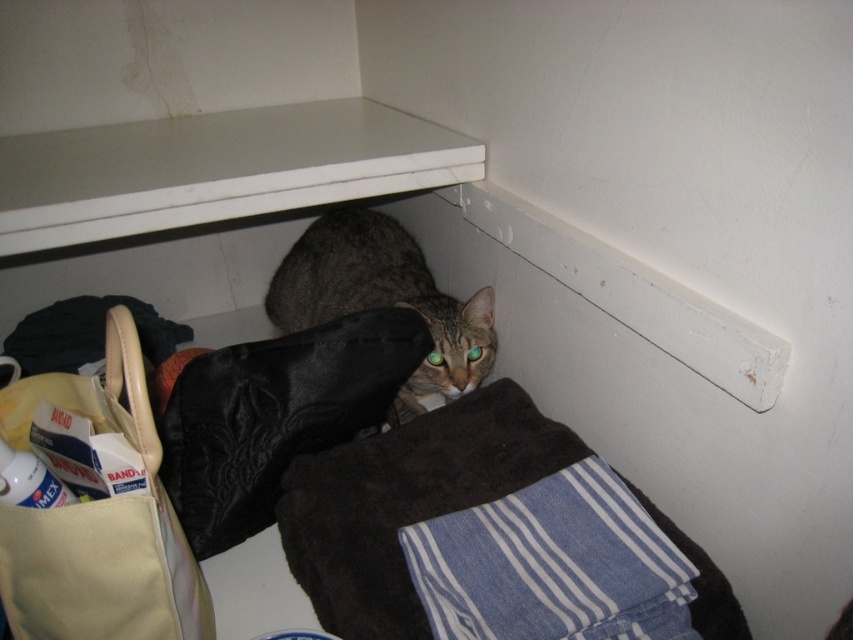
From the picture: You are organizing items in a storage area and need to place a new box on the white matte shelf at upper center. According to the scene description, where exactly is the white matte shelf located?

The white matte shelf at upper center is located at point (x=216, y=170), so you can place the box there.

You are standing in the storage area and see two points marked in the image. Which point is closer to you, point (502, 566) or point (166, 579)?

Point (502, 566) is further to the viewer than point (166, 579), so point (502, 566) is closer to you.

You are organizing the storage area and need to place both the blue striped fabric at lower right and the yellow fabric bag at lower left. Which item has a greater width?

The blue striped fabric at lower right has a greater width than the yellow fabric bag at lower left according to the description.